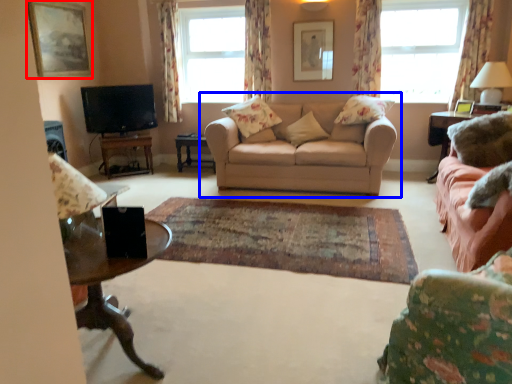
Question: Among these objects, which one is nearest to the camera, picture frame (highlighted by a red box) or studio couch (highlighted by a blue box)?

Choices:
 (A) picture frame
 (B) studio couch

Answer: (B)